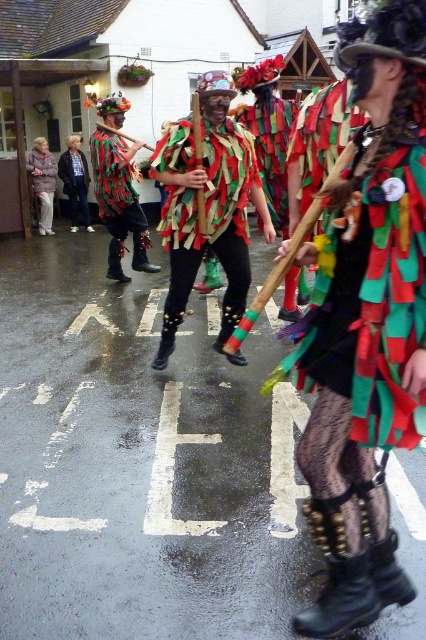
Question: Does multicolored fabric strips at center have a smaller size compared to shiny metallic costume at center?

Choices:
 (A) yes
 (B) no

Answer: (A)

Question: Based on their relative distances, which object is nearer to the matte black pants at left?

Choices:
 (A) textured fabric costume at center
 (B) shiny metallic vest at center
 (C) shiny metallic costume at center

Answer: (B)

Question: From the image, what is the correct spatial relationship of textured fabric costume at center in relation to multicolored fabric strips at center?

Choices:
 (A) below
 (B) above

Answer: (A)

Question: Does shiny metallic costume at center appear under shiny metallic vest at center?

Choices:
 (A) no
 (B) yes

Answer: (B)

Question: Which point is farther to the camera?

Choices:
 (A) (115, 168)
 (B) (305, 442)
 (C) (80, 168)

Answer: (C)

Question: Which object is the farthest from the shiny metallic vest at center?

Choices:
 (A) multicolored fabric strips at center
 (B) textured fabric costume at center
 (C) shiny metallic costume at center

Answer: (B)